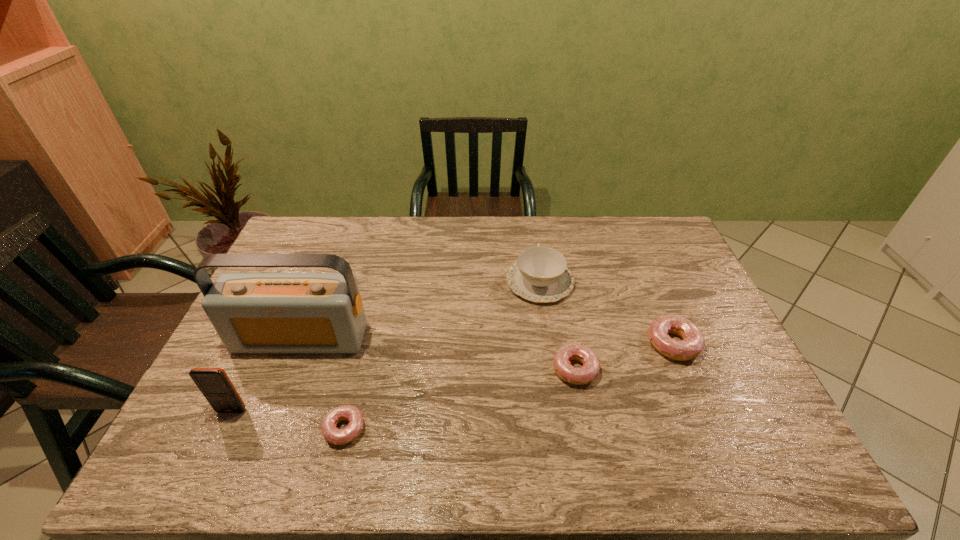
Please determine a free point for an extra doughnut to ensure balance. Please provide its 2D coordinates. Your answer should be formatted as a tuple, i.e. [(x, y)], where the tuple contains the x and y coordinates of a point satisfying the conditions above.

[(467, 397)]